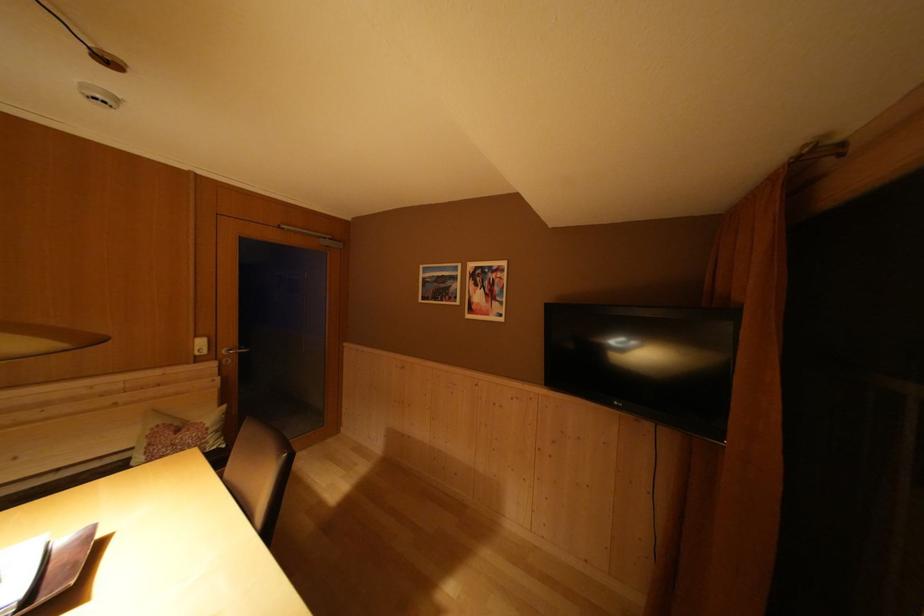
Find the location of a particular element. Image resolution: width=924 pixels, height=616 pixels. white light switch is located at coordinates (200, 345).